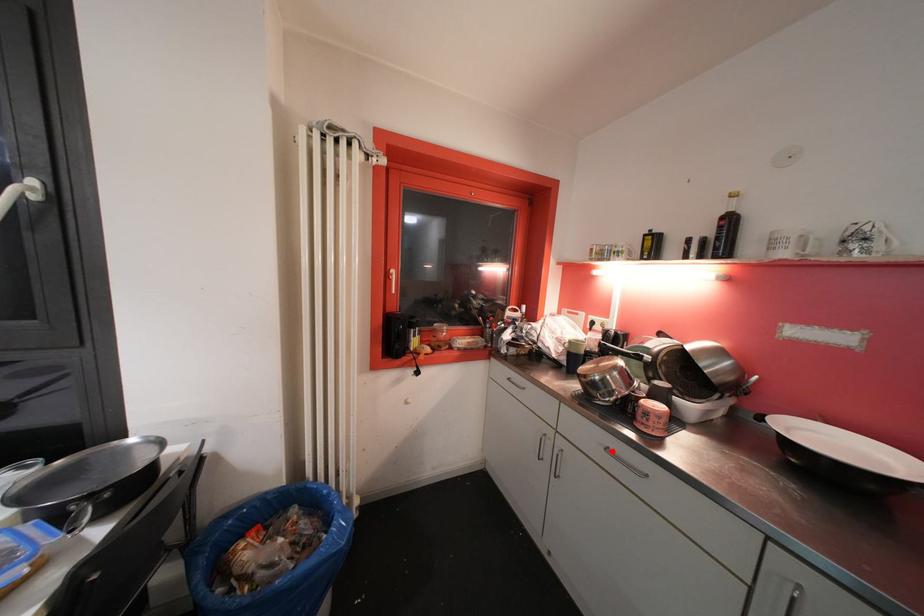
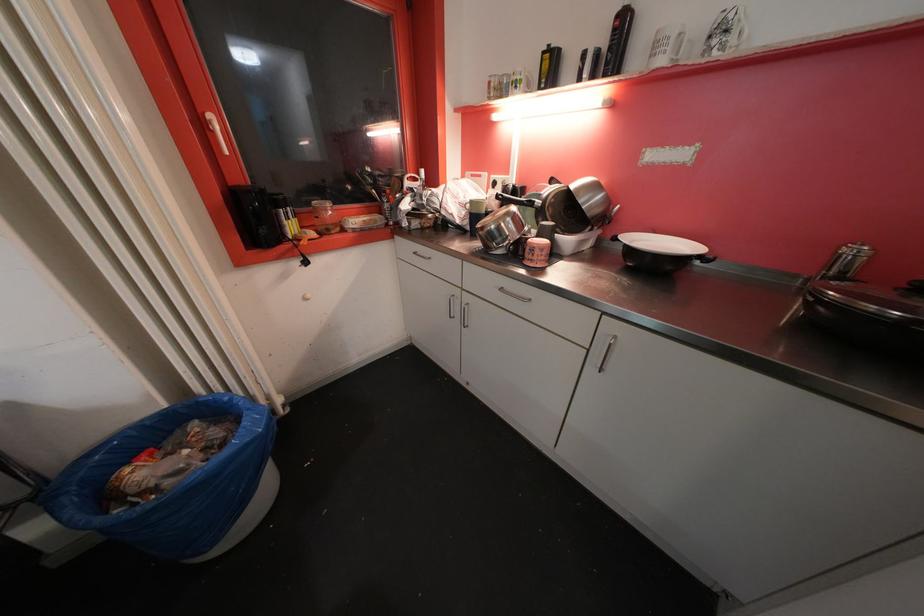
The point at the highlighted location is marked in the first image. Where is the corresponding point in the second image?

(506, 292)